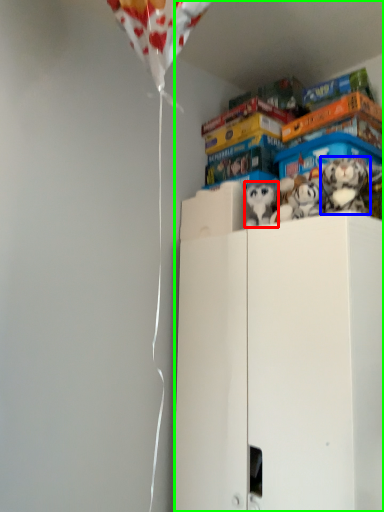
Question: Estimate the real-world distances between objects in this image. Which object is closer to toy (highlighted by a red box), toy (highlighted by a blue box) or cabinetry (highlighted by a green box)?

Choices:
 (A) toy
 (B) cabinetry

Answer: (A)